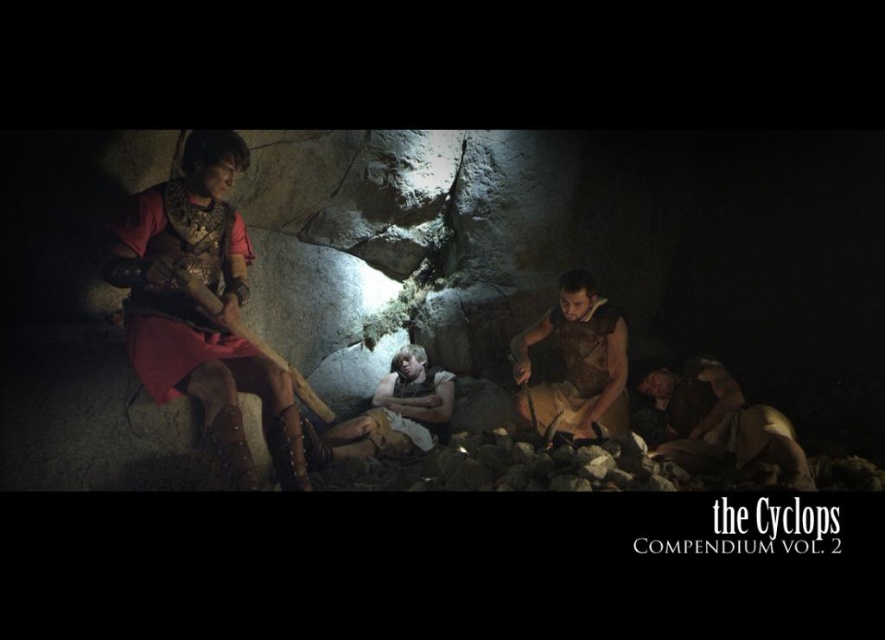
Can you confirm if brown leather armor at center is positioned to the left of light brown leather armor at center?

No, brown leather armor at center is not to the left of light brown leather armor at center.

Image resolution: width=885 pixels, height=640 pixels. What do you see at coordinates (576, 362) in the screenshot? I see `brown leather armor at center` at bounding box center [576, 362].

Does point (568, 346) come in front of point (439, 385)?

Yes, it is.

Find the location of a particular element. This screenshot has height=640, width=885. brown leather armor at center is located at coordinates coord(576,362).

Does point (747, 444) come in front of point (589, 340)?

Yes, it is in front of point (589, 340).

Between point (701, 465) and point (599, 381), which one is positioned behind?

The point (599, 381) is more distant.

In order to click on brown leather armor at lower right in this screenshot , I will do `click(722, 428)`.

Does brown leather armor at lower right lie in front of light brown leather armor at center?

Yes, brown leather armor at lower right is in front of light brown leather armor at center.

Who is more distant from viewer, (x=781, y=445) or (x=382, y=419)?

The point (x=382, y=419) is behind.

You are a GUI agent. You are given a task and a screenshot of the screen. Output one action in this format:
    pyautogui.click(x=<x>, y=<y>)
    Task: Click on the brown leather armor at lower right
    
    Given the screenshot: What is the action you would take?
    pyautogui.click(x=722, y=428)